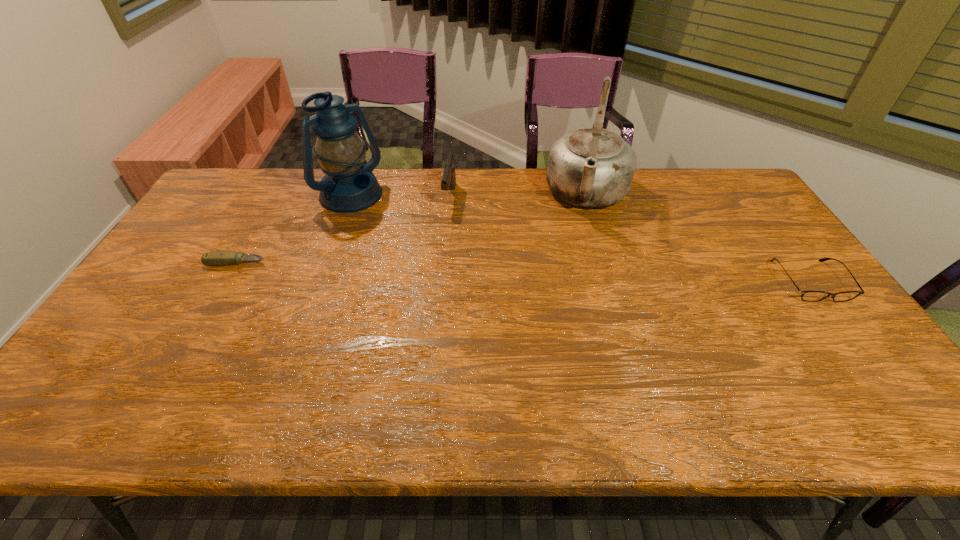
Where is `vacant space on the desktop that is between the leftmost object and the rightmost object and is positioned at the spout of the second object from right to left`? This screenshot has height=540, width=960. vacant space on the desktop that is between the leftmost object and the rightmost object and is positioned at the spout of the second object from right to left is located at coordinates (572, 273).

Where is `vacant spot on the desktop that is between the pocketknife and the rightmost object and is positioned aim along the barrel of the third tallest object`? The height and width of the screenshot is (540, 960). vacant spot on the desktop that is between the pocketknife and the rightmost object and is positioned aim along the barrel of the third tallest object is located at coordinates (433, 269).

Locate an element on the screen. This screenshot has width=960, height=540. free spot on the desktop that is between the shortest object and the fourth tallest object and is positioned on the face of the fourth object from right to left is located at coordinates (433, 269).